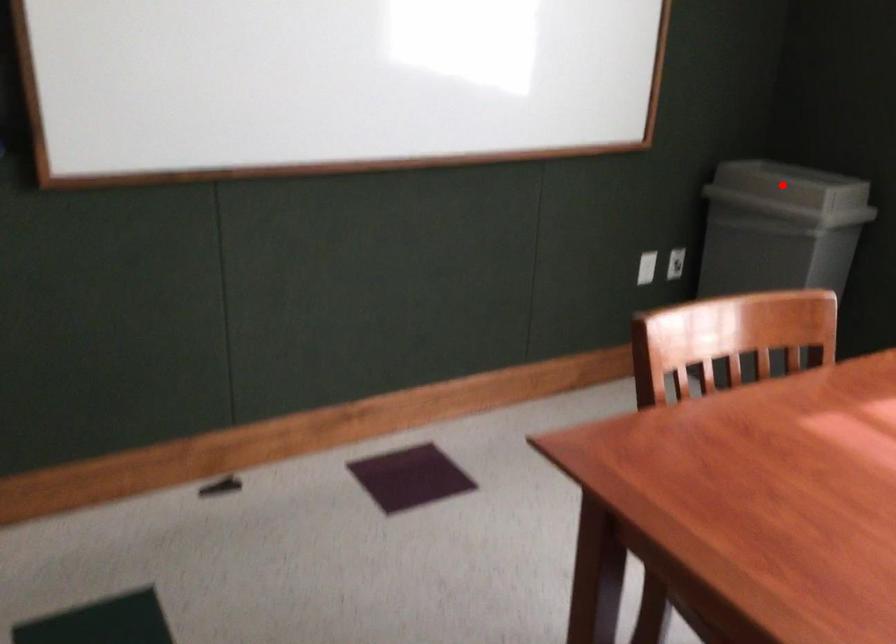
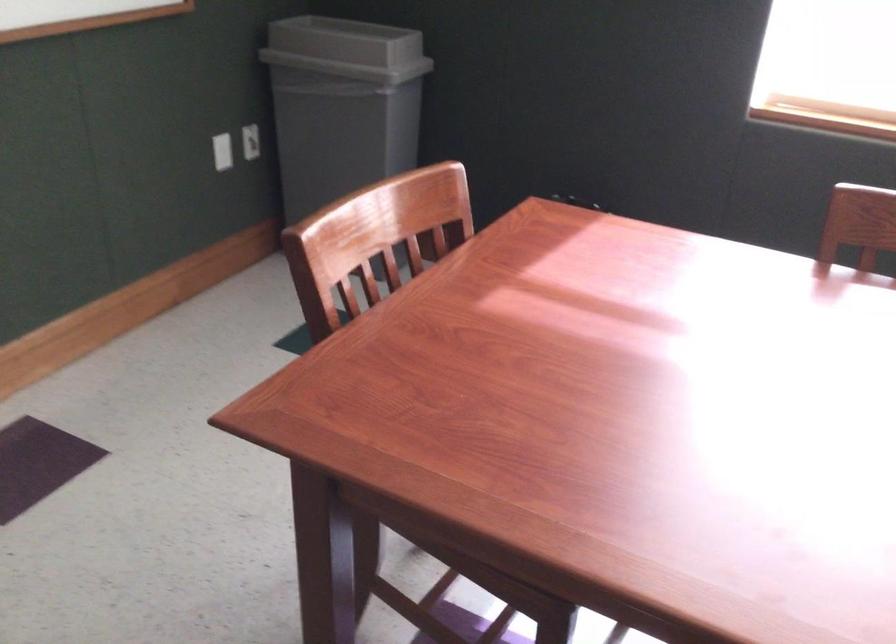
In the second image, find the point that corresponds to the highlighted location in the first image.

(346, 49)